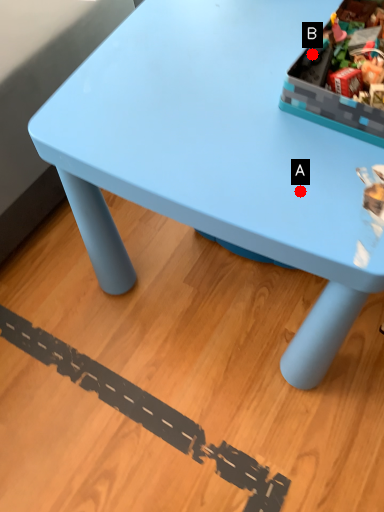
Question: Two points are circled on the image, labeled by A and B beside each circle. Which point appears closest to the camera in this image?

Choices:
 (A) A is closer
 (B) B is closer

Answer: (A)